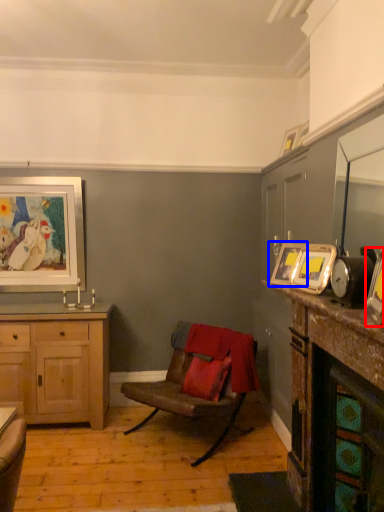
Question: Which point is further to the camera, picture frame (highlighted by a red box) or picture frame (highlighted by a blue box)?

Choices:
 (A) picture frame
 (B) picture frame

Answer: (B)